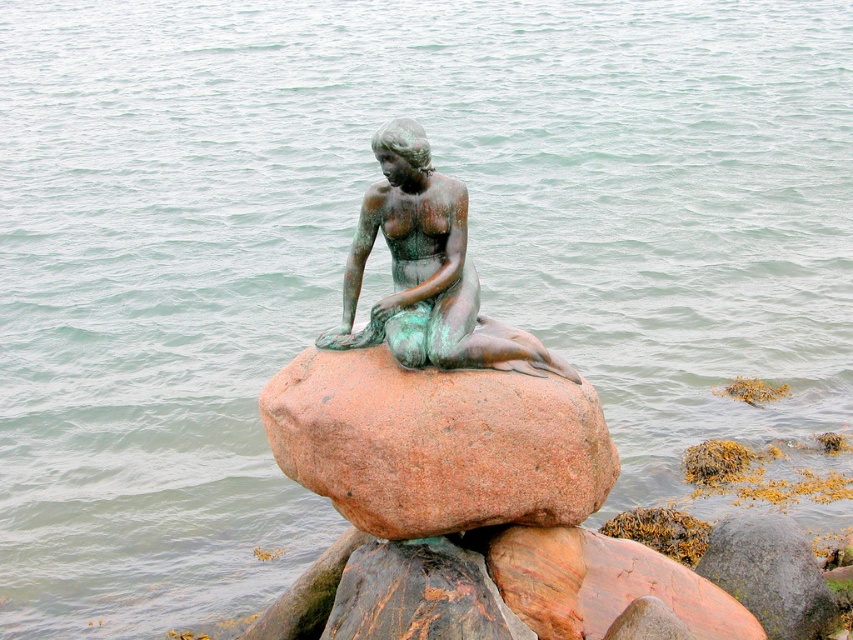
Question: Does green patina bronze mermaid at center have a smaller size compared to rusty granite boulder at center?

Choices:
 (A) yes
 (B) no

Answer: (A)

Question: Does green patina bronze mermaid at center have a smaller size compared to green patina statue at center?

Choices:
 (A) no
 (B) yes

Answer: (B)

Question: Which of these objects is positioned farthest from the green patina bronze mermaid at center?

Choices:
 (A) rusty granite boulder at center
 (B) green patina statue at center

Answer: (A)

Question: Is green patina bronze mermaid at center positioned in front of rusty granite boulder at center?

Choices:
 (A) yes
 (B) no

Answer: (B)

Question: Which point is farther to the camera?

Choices:
 (A) green patina statue at center
 (B) green patina bronze mermaid at center
 (C) rusty granite boulder at center

Answer: (A)

Question: Which point appears closest to the camera in this image?

Choices:
 (A) (433, 273)
 (B) (488, 522)

Answer: (B)